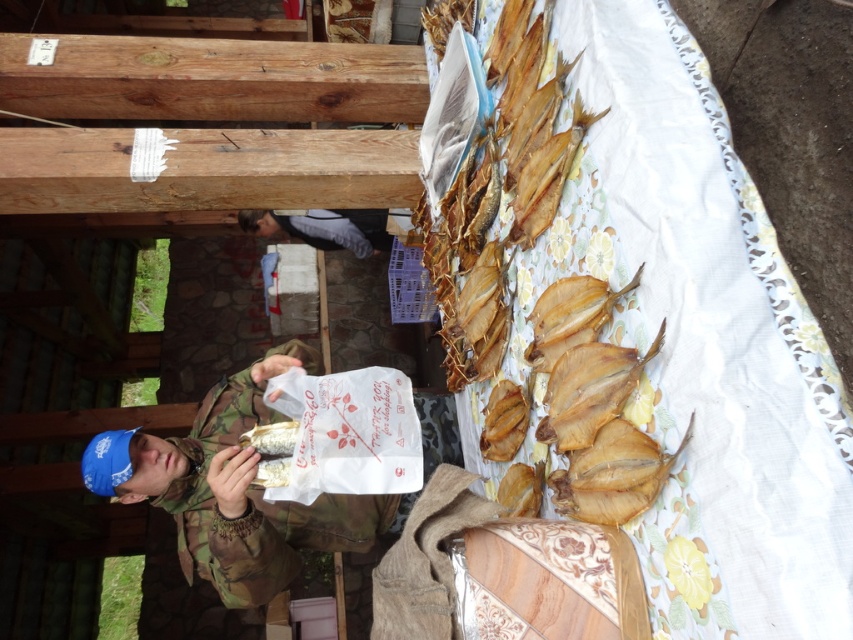
Question: Is camouflage jacket at center below gray fabric at center?

Choices:
 (A) no
 (B) yes

Answer: (B)

Question: Which point is farther to the camera?

Choices:
 (A) gray fabric at center
 (B) camouflage jacket at center

Answer: (A)

Question: Based on their relative distances, which object is nearer to the brown crispy fish at upper right?

Choices:
 (A) gray fabric at center
 (B) camouflage jacket at center

Answer: (B)

Question: Where is brown crispy fish at upper right located in relation to gray fabric at center in the image?

Choices:
 (A) below
 (B) above

Answer: (A)

Question: Does camouflage jacket at center have a greater width compared to gray fabric at center?

Choices:
 (A) yes
 (B) no

Answer: (B)

Question: Which point is farther to the camera?

Choices:
 (A) (315, 236)
 (B) (605, 499)
 (C) (103, 456)

Answer: (A)